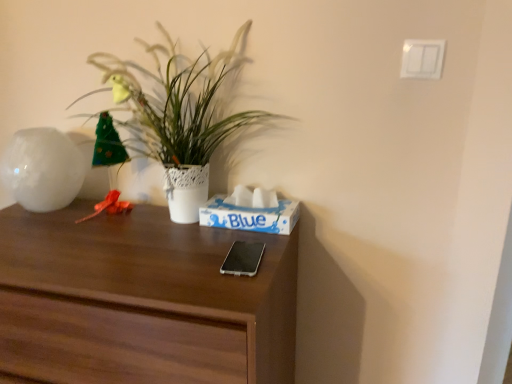
Where is `free location in front of silver metallic phone at center`? The image size is (512, 384). free location in front of silver metallic phone at center is located at coordinates (224, 295).